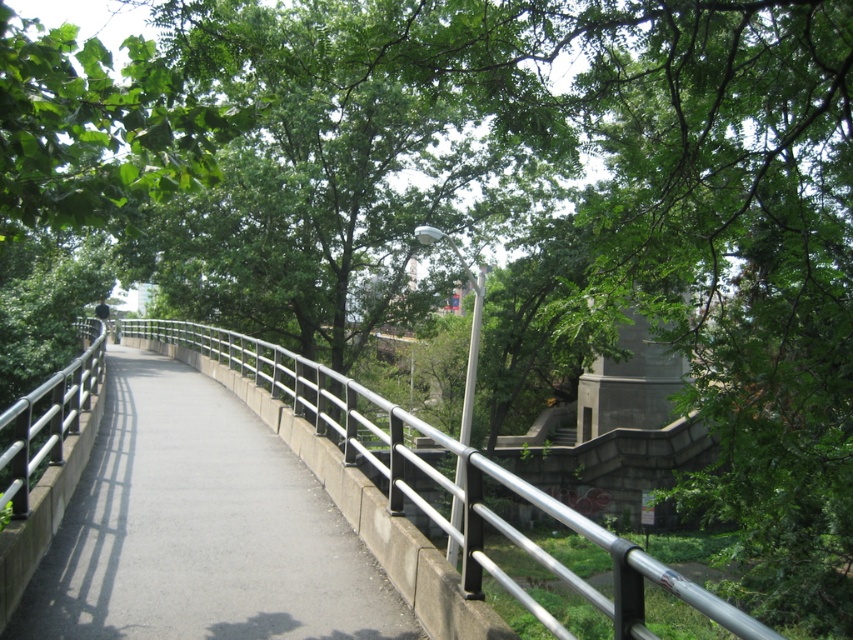
From the picture: You are walking along the gray concrete path at center and want to reach the silver metallic rail at center. In which direction should you move relative to the path?

Since the gray concrete path at center is to the right of the silver metallic rail at center, you should move to your left to reach the rail.

You are standing on the gray concrete path at center and want to reach a bench located 5 meters ahead. Can you walk straight ahead without stepping off the path?

The gray concrete path at center and viewer are 4.39 meters apart. Since the bench is 5 meters ahead, you can walk straight ahead without stepping off the path because the path extends beyond your current position by at least 0.61 meters.